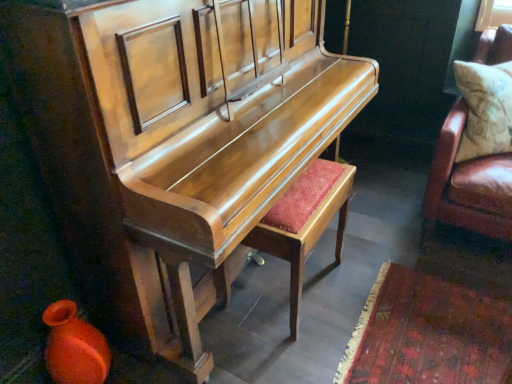
Locate an element on the screen. The height and width of the screenshot is (384, 512). empty space that is in between matte wood stool at center and shiny wood piano at center, the 2th furniture when ordered from right to left is located at coordinates (328, 282).